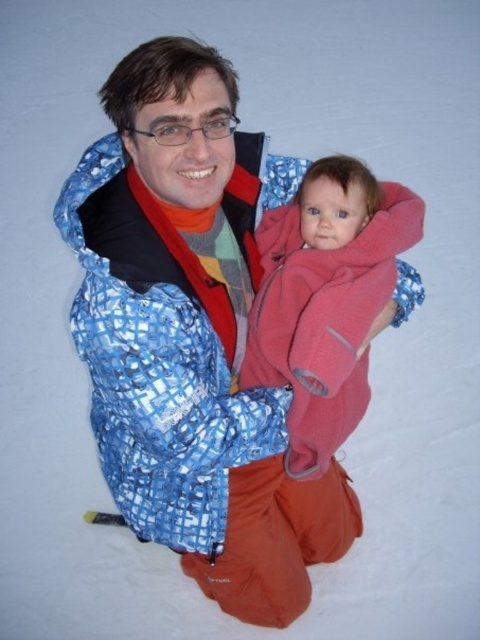
You are a photographer standing at a certain distance from the blue checkered jacket at center. If you want to capture the entire scene in one shot without moving closer, what is the minimum focal length required for your camera lens?

The minimum focal length required to capture the entire scene with the blue checkered jacket at center at a distance of 5.00 feet would depend on the sensor size of the camera. Without knowing the sensor dimensions, an exact focal length cannot be determined. However, a wide angle lens is generally recommended for capturing wide scenes from close distances.

Based on the scene description, which object is taller between the blue checkered jacket at center and the soft pink fleece at center?

The blue checkered jacket at center is taller than the soft pink fleece at center according to the description.

You are a photographer trying to capture a closeup shot of the blue checkered jacket at center and the soft pink fleece at center. Since you want to focus on both items equally, which one should you adjust your camera settings to prioritize in terms of size in the frame?

The blue checkered jacket at center is wider than the soft pink fleece at center, so to ensure both items appear equally sized in the frame, you should position the camera closer to the soft pink fleece at center or move the blue checkered jacket at center further back.